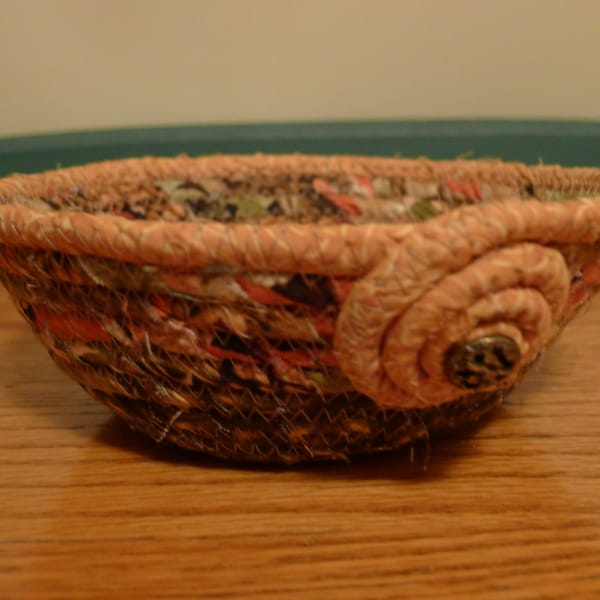
Locate an element on the screen. The height and width of the screenshot is (600, 600). basket is located at coordinates (398, 300).